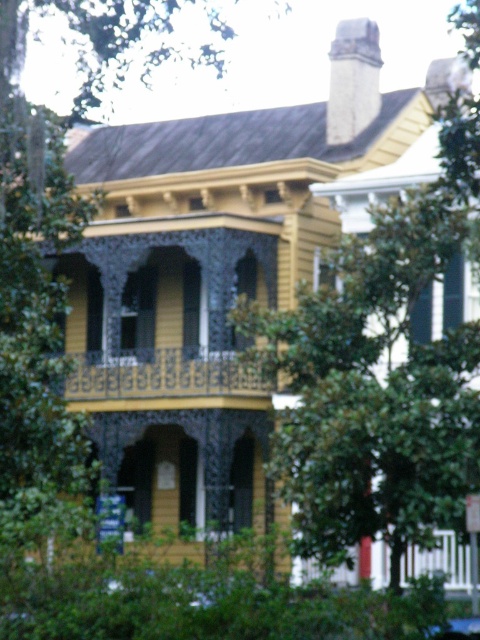
Looking at this image, you are standing in front of the two story house and want to know what is located at the center of the image. According to the coordinates provided, what is at point (x=372, y=388)?

The point (x=372, y=388) indicates a green leafy tree at center.